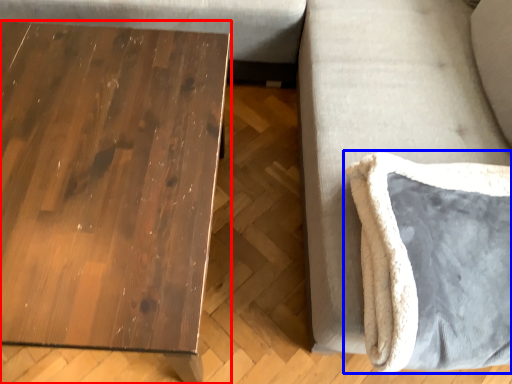
Question: Among these objects, which one is farthest to the camera, table (highlighted by a red box) or swivel chair (highlighted by a blue box)?

Choices:
 (A) table
 (B) swivel chair

Answer: (A)